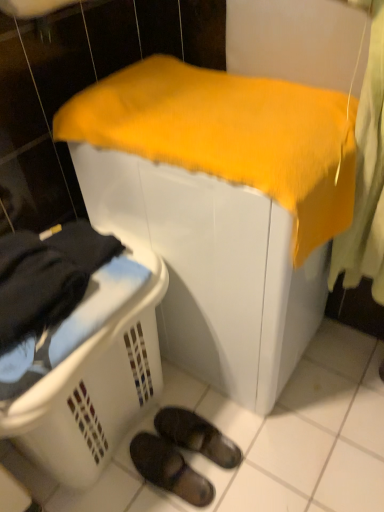
Find the location of a particular element. vacant space to the right of black rubber slippers at lower center, the second footwear from the top is located at coordinates (243, 461).